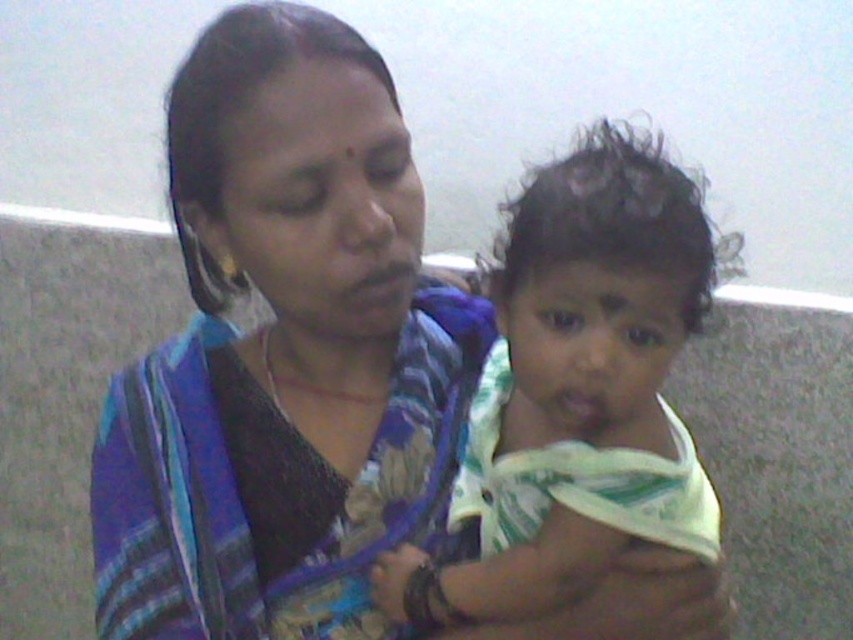
Question: Among these objects, which one is nearest to the camera?

Choices:
 (A) white cotton cloth at center
 (B) blue striped sari at center

Answer: (A)

Question: From the image, what is the correct spatial relationship of blue striped sari at center in relation to white cotton cloth at center?

Choices:
 (A) below
 (B) above

Answer: (B)

Question: Can you confirm if blue striped sari at center is positioned above white cotton cloth at center?

Choices:
 (A) no
 (B) yes

Answer: (B)

Question: Can you confirm if blue striped sari at center is positioned above white cotton cloth at center?

Choices:
 (A) no
 (B) yes

Answer: (B)